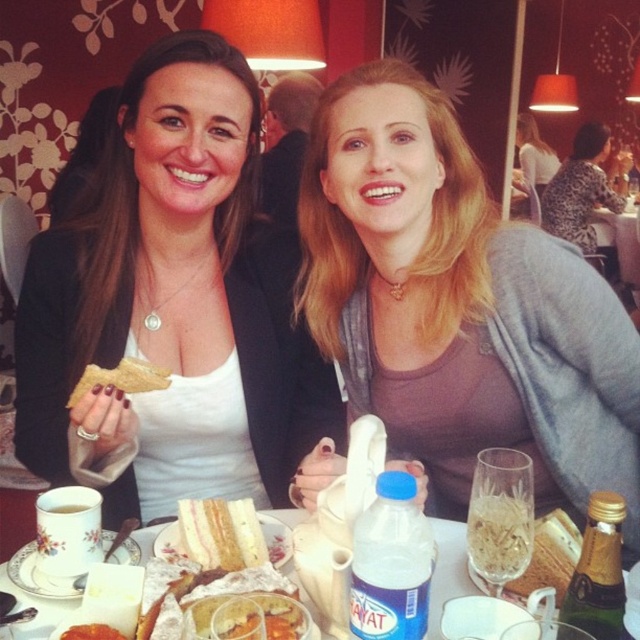
You are a waiter at the cafe and need to place a new dessert menu between the matte white shirt at center and the pink sponge cake at center on the table. Which object should you place the menu closer to to ensure it doesn

The matte white shirt at center is larger in size than the pink sponge cake at center, so placing the dessert menu closer to the pink sponge cake at center would leave more space between them.

You are a photographer positioned to capture the scene of two women at a table. You want to focus on the matte white shirt at center and the golden crisp bread at upper left. Which object should you adjust your camera to focus on first if you want to start with the one closer to the foreground?

The golden crisp bread at upper left is closer to the foreground than the matte white shirt at center, so you should focus on the golden crisp bread at upper left first.

You are a waiter at the cafe and need to place a new order of a large dessert plate between the matte white shirt at center and the golden crisp bread at upper left. Can you fit it there without moving either object?

The matte white shirt at center is bigger than the golden crisp bread at upper left. Since the dessert plate is large, it might not fit between them if the space is constrained by the size of the existing objects. However, the exact placement depends on the available space between the two items, which isn